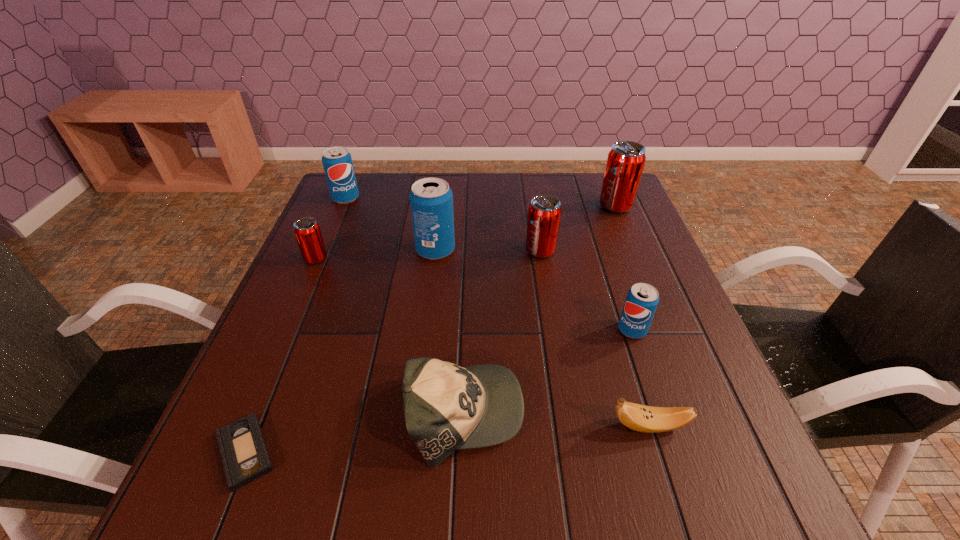
Where is `the smallest blue soda can`? The height and width of the screenshot is (540, 960). the smallest blue soda can is located at coordinates pos(642,299).

The height and width of the screenshot is (540, 960). I want to click on green baseball cap, so [446, 407].

The height and width of the screenshot is (540, 960). What are the coordinates of `banana` in the screenshot? It's located at (647, 419).

Locate an element on the screen. videotape is located at coordinates (245, 456).

Image resolution: width=960 pixels, height=540 pixels. What are the coordinates of `free spot located on the front of the second nearest blue soda can` in the screenshot? It's located at (420, 383).

Where is `free space located on the front of the biggest red soda can`? free space located on the front of the biggest red soda can is located at coordinates (650, 291).

I want to click on vacant space located 0.200m on the front of the second smallest blue soda can, so click(x=325, y=247).

Find the location of `vacant space located 0.180m on the back of the fourth soda can from left to right`. vacant space located 0.180m on the back of the fourth soda can from left to right is located at coordinates (533, 205).

The image size is (960, 540). I want to click on vacant region located on the right of the smallest red soda can, so (x=480, y=259).

Locate an element on the screen. This screenshot has width=960, height=540. vacant point located 0.050m on the left of the smallest blue soda can is located at coordinates (594, 330).